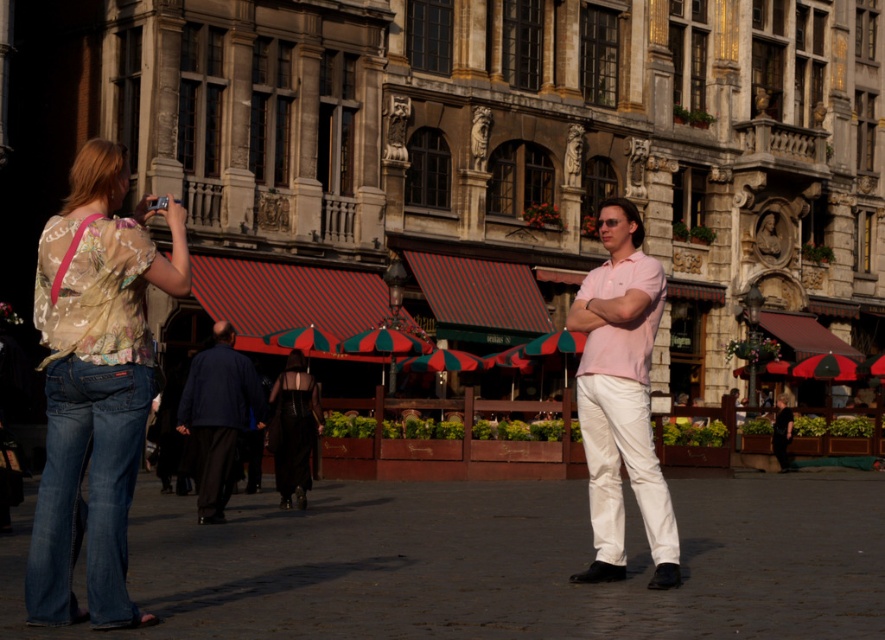
Question: Which point is farther from the camera taking this photo?

Choices:
 (A) (99, 216)
 (B) (279, 428)
 (C) (209, 368)
 (D) (609, 269)

Answer: (B)

Question: From the image, what is the correct spatial relationship of matte pink shirt at center in relation to black satin dress at center?

Choices:
 (A) below
 (B) above

Answer: (B)

Question: Which point is closer to the camera?

Choices:
 (A) pyautogui.click(x=296, y=400)
 (B) pyautogui.click(x=216, y=452)

Answer: (B)

Question: Which of the following is the closest to the observer?

Choices:
 (A) dark blue fabric jacket at center
 (B) black satin dress at center
 (C) matte pink shirt at center

Answer: (C)

Question: Observing the image, what is the correct spatial positioning of denim jeans at left in reference to matte pink shirt at center?

Choices:
 (A) above
 (B) below

Answer: (A)

Question: Observing the image, what is the correct spatial positioning of matte pink shirt at center in reference to dark blue fabric jacket at center?

Choices:
 (A) above
 (B) below

Answer: (A)